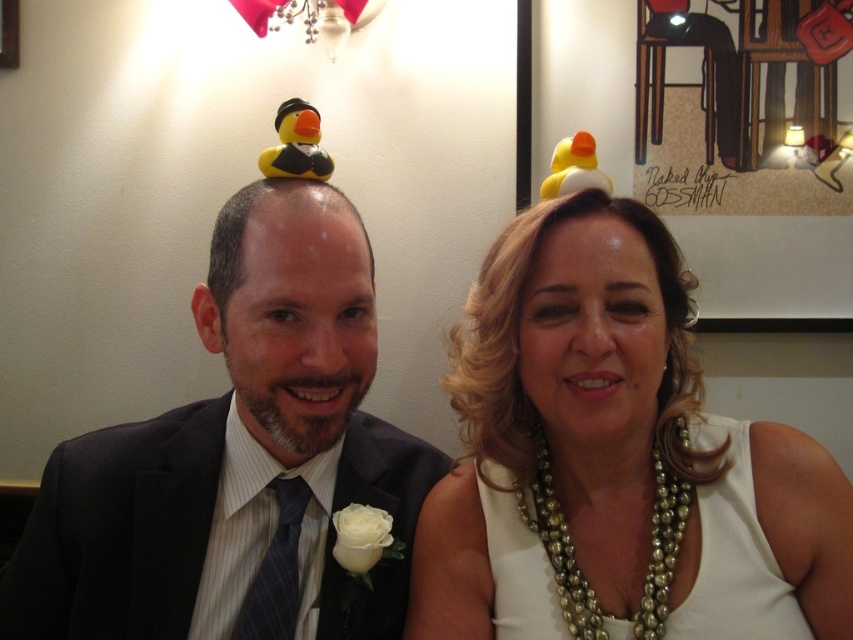
Based on the photo, between matte black suit at left and white pearl necklace at center, which one is positioned lower?

white pearl necklace at center

Can you confirm if matte black suit at left is positioned to the right of white pearl necklace at center?

In fact, matte black suit at left is to the left of white pearl necklace at center.

Measure the distance between point (248, 568) and camera.

The distance of point (248, 568) from camera is 32.15 inches.

The width and height of the screenshot is (853, 640). What are the coordinates of `matte black suit at left` in the screenshot? It's located at (236, 458).

Looking at this image, who is lower down, pearl necklace at upper center or matte black suit at left?

Positioned lower is pearl necklace at upper center.

Find the location of a particular element. This screenshot has height=640, width=853. pearl necklace at upper center is located at coordinates coord(614,460).

Does point (804, 627) come behind point (698, 628)?

Yes, point (804, 627) is farther from viewer.

Which is above, pearl necklace at upper center or white pearl necklace at center?

Positioned higher is pearl necklace at upper center.

What do you see at coordinates (614, 460) in the screenshot?
I see `pearl necklace at upper center` at bounding box center [614, 460].

At what (x,y) coordinates should I click in order to perform the action: click on pearl necklace at upper center. Please return your answer as a coordinate pair (x, y). Looking at the image, I should click on (614, 460).